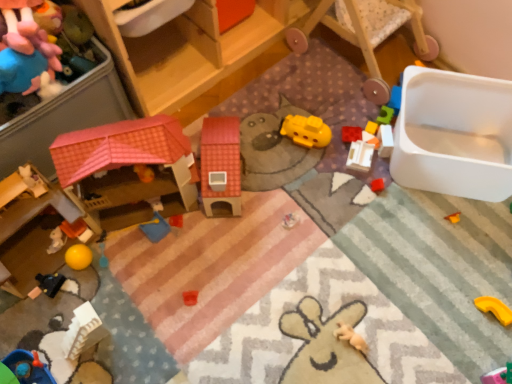
I want to click on free space to the back side of white plastic building at center-right, positioned as the 4th toy in right-to-left order, so click(347, 117).